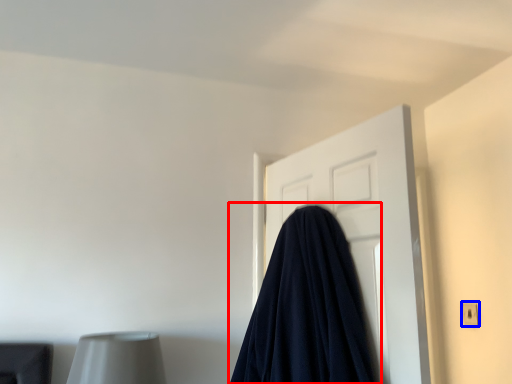
Question: Among these objects, which one is farthest to the camera, blanket (highlighted by a red box) or electric outlet (highlighted by a blue box)?

Choices:
 (A) blanket
 (B) electric outlet

Answer: (B)